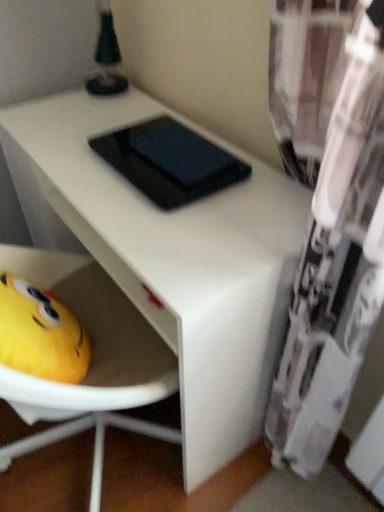
Question: Looking at the image, does white matte table at center seem bigger or smaller compared to black matte pad at center?

Choices:
 (A) small
 (B) big

Answer: (B)

Question: Is white matte table at center in front of or behind black matte pad at center in the image?

Choices:
 (A) front
 (B) behind

Answer: (A)

Question: From a real-world perspective, is white matte table at center above or below black matte pad at center?

Choices:
 (A) above
 (B) below

Answer: (B)

Question: Is black matte pad at center inside the boundaries of white matte table at center, or outside?

Choices:
 (A) inside
 (B) outside

Answer: (B)

Question: In terms of width, does black matte pad at center look wider or thinner when compared to white matte table at center?

Choices:
 (A) wide
 (B) thin

Answer: (B)

Question: Considering the positions of black matte pad at center and white matte table at center in the image, is black matte pad at center bigger or smaller than white matte table at center?

Choices:
 (A) small
 (B) big

Answer: (A)

Question: In the image, is black matte pad at center on the left side or the right side of white matte table at center?

Choices:
 (A) left
 (B) right

Answer: (B)